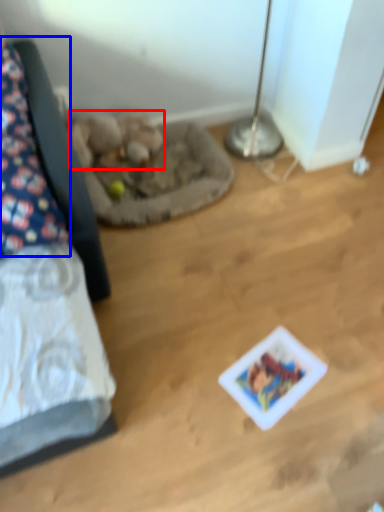
Question: Which of the following is the closest to the observer, animal (highlighted by a red box) or pillow (highlighted by a blue box)?

Choices:
 (A) animal
 (B) pillow

Answer: (B)